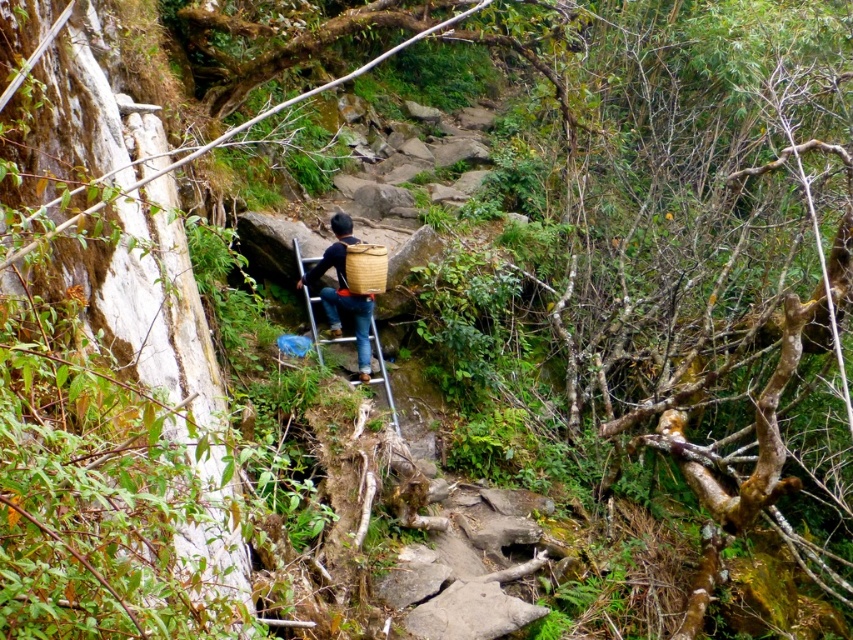
Question: Can you confirm if metallic silver ladder at center is bigger than woven bamboo basket at center?

Choices:
 (A) yes
 (B) no

Answer: (A)

Question: Which object is the farthest from the metallic silver ladder at center?

Choices:
 (A) brown woven basket at center
 (B) woven bamboo basket at center

Answer: (B)

Question: Which is farther from the brown woven basket at center?

Choices:
 (A) metallic silver ladder at center
 (B) woven bamboo basket at center

Answer: (B)

Question: Among these points, which one is nearest to the camera?

Choices:
 (A) (300, 276)
 (B) (363, 262)
 (C) (312, 304)

Answer: (B)

Question: Does metallic silver ladder at center come behind woven bamboo basket at center?

Choices:
 (A) no
 (B) yes

Answer: (A)

Question: Observing the image, what is the correct spatial positioning of brown woven basket at center in reference to metallic silver ladder at center?

Choices:
 (A) below
 (B) above

Answer: (B)